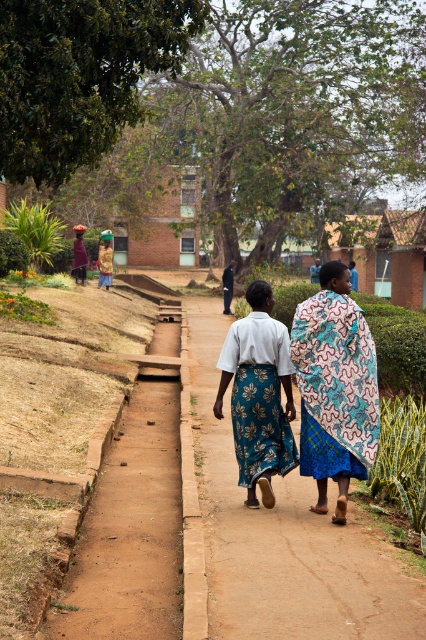
Question: Which point appears farthest from the camera in this image?

Choices:
 (A) (267, 355)
 (B) (155, 602)
 (C) (307, 492)
 (D) (371, 458)

Answer: (C)

Question: Does brown dirt path at lower left have a larger size compared to blue floral skirt at center?

Choices:
 (A) yes
 (B) no

Answer: (A)

Question: Does brown dirt path at lower left have a smaller size compared to blue floral skirt at center?

Choices:
 (A) no
 (B) yes

Answer: (A)

Question: Is brown dirt path at center to the right of patterned fabric dress at center from the viewer's perspective?

Choices:
 (A) yes
 (B) no

Answer: (B)

Question: Based on their relative distances, which object is nearer to the brown dirt path at center?

Choices:
 (A) blue floral skirt at center
 (B) blue floral fabric at center
 (C) brown dirt path at lower left
 (D) patterned fabric dress at center

Answer: (C)

Question: Which object is the farthest from the brown dirt path at center?

Choices:
 (A) blue floral fabric at center
 (B) patterned fabric dress at center

Answer: (B)